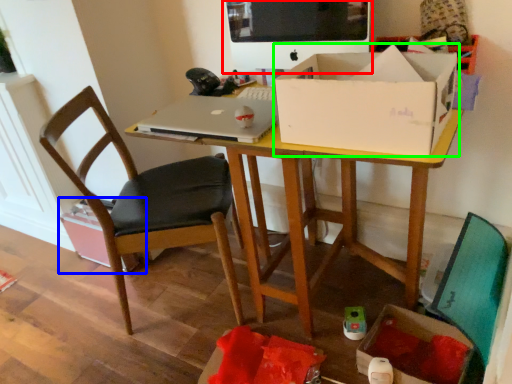
Question: Considering the real-world distances, which object is farthest from computer monitor (highlighted by a red box)? cardboard box (highlighted by a blue box) or box (highlighted by a green box)?

Choices:
 (A) cardboard box
 (B) box

Answer: (A)